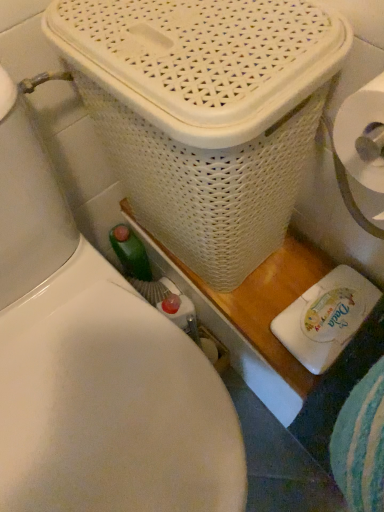
Where is `white plastic toilet at upper center`? The height and width of the screenshot is (512, 384). white plastic toilet at upper center is located at coordinates (95, 367).

The image size is (384, 512). What do you see at coordinates (95, 367) in the screenshot?
I see `white plastic toilet at upper center` at bounding box center [95, 367].

Locate an element on the screen. This screenshot has width=384, height=512. white wicker basket at upper center is located at coordinates (205, 113).

Describe the element at coordinates (205, 113) in the screenshot. The width and height of the screenshot is (384, 512). I see `white wicker basket at upper center` at that location.

Locate an element on the screen. white plastic toilet at upper center is located at coordinates (95, 367).

Based on the photo, considering the relative positions of white plastic toilet at upper center and white wicker basket at upper center in the image provided, is white plastic toilet at upper center to the right of white wicker basket at upper center from the viewer's perspective?

No.

Does white plastic toilet at upper center lie behind white wicker basket at upper center?

No, the depth of white plastic toilet at upper center is less than that of white wicker basket at upper center.

Looking at this image, which point is more distant from viewer, (57, 269) or (296, 97)?

The point (57, 269) is farther from the camera.

From the image's perspective, between white plastic toilet at upper center and white wicker basket at upper center, who is located below?

white plastic toilet at upper center is shown below in the image.

In the scene shown: From a real-world perspective, who is located lower, white plastic toilet at upper center or white wicker basket at upper center?

From a 3D spatial view, white plastic toilet at upper center is below.

Which of these two, white plastic toilet at upper center or white wicker basket at upper center, is wider?

white plastic toilet at upper center.

Who is shorter, white plastic toilet at upper center or white wicker basket at upper center?

white wicker basket at upper center is shorter.

Is white plastic toilet at upper center bigger or smaller than white wicker basket at upper center?

Considering their sizes, white plastic toilet at upper center takes up more space than white wicker basket at upper center.

Would you say white plastic toilet at upper center is outside white wicker basket at upper center?

Yes.

In the scene shown: Is white plastic toilet at upper center far from white wicker basket at upper center?

No, there isn't a large distance between white plastic toilet at upper center and white wicker basket at upper center.

Is white plastic toilet at upper center oriented away from white wicker basket at upper center?

No.

Where is `basket container above the white plastic toilet at upper center (from the image's perspective)`? This screenshot has width=384, height=512. basket container above the white plastic toilet at upper center (from the image's perspective) is located at coordinates (205, 113).

Considering the positions of objects white wicker basket at upper center and white plastic toilet at upper center in the image provided, who is more to the left, white wicker basket at upper center or white plastic toilet at upper center?

Positioned to the left is white plastic toilet at upper center.

Is white wicker basket at upper center in front of or behind white plastic toilet at upper center in the image?

Clearly, white wicker basket at upper center is behind white plastic toilet at upper center.

Which point is more forward, (192, 104) or (132, 408)?

The point (192, 104) is more forward.

From the image's perspective, is white wicker basket at upper center positioned above or below white plastic toilet at upper center?

Based on their image positions, white wicker basket at upper center is located above white plastic toilet at upper center.

In the scene shown: From a real-world perspective, relative to white plastic toilet at upper center, is white wicker basket at upper center vertically above or below?

In terms of real-world spatial position, white wicker basket at upper center is above white plastic toilet at upper center.

Considering the relative sizes of white wicker basket at upper center and white plastic toilet at upper center in the image provided, is white wicker basket at upper center thinner than white plastic toilet at upper center?

Indeed, white wicker basket at upper center has a lesser width compared to white plastic toilet at upper center.

In terms of height, does white wicker basket at upper center look taller or shorter compared to white plastic toilet at upper center?

In the image, white wicker basket at upper center appears to be shorter than white plastic toilet at upper center.

Considering the sizes of objects white wicker basket at upper center and white plastic toilet at upper center in the image provided, who is smaller, white wicker basket at upper center or white plastic toilet at upper center?

white wicker basket at upper center is smaller.

Is white plastic toilet at upper center located within white wicker basket at upper center?

No.

Can you see white wicker basket at upper center touching white plastic toilet at upper center?

No.

Is white wicker basket at upper center facing towards white plastic toilet at upper center?

Yes, white wicker basket at upper center is facing white plastic toilet at upper center.

Where is `basket container above the white plastic toilet at upper center (from a real-world perspective)`? basket container above the white plastic toilet at upper center (from a real-world perspective) is located at coordinates (205, 113).

Identify the location of toilet in front of the white wicker basket at upper center. The image size is (384, 512). (95, 367).

Locate an element on the screen. This screenshot has height=512, width=384. basket container that appears above the white plastic toilet at upper center (from a real-world perspective) is located at coordinates (205, 113).